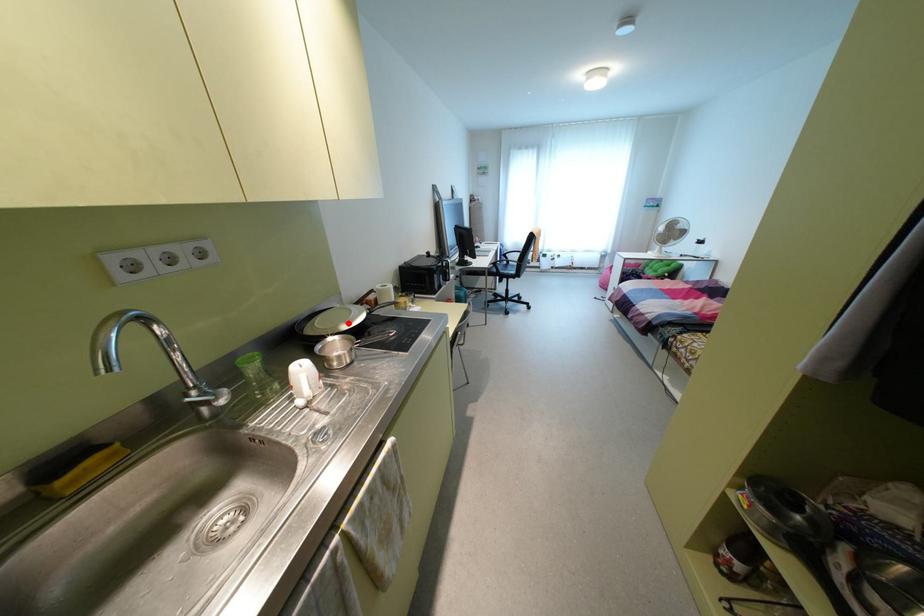
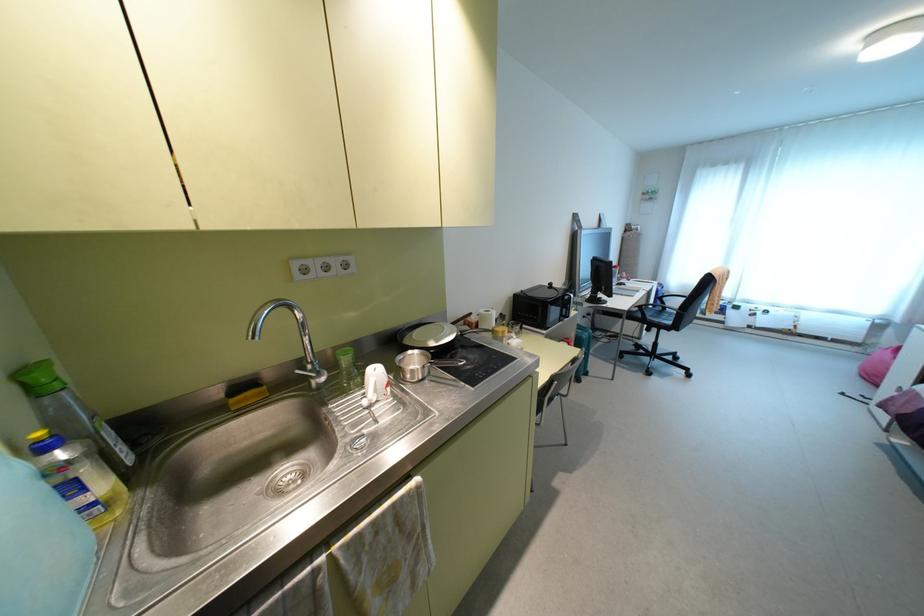
The point at the highlighted location is marked in the first image. Where is the corresponding point in the second image?

(435, 341)